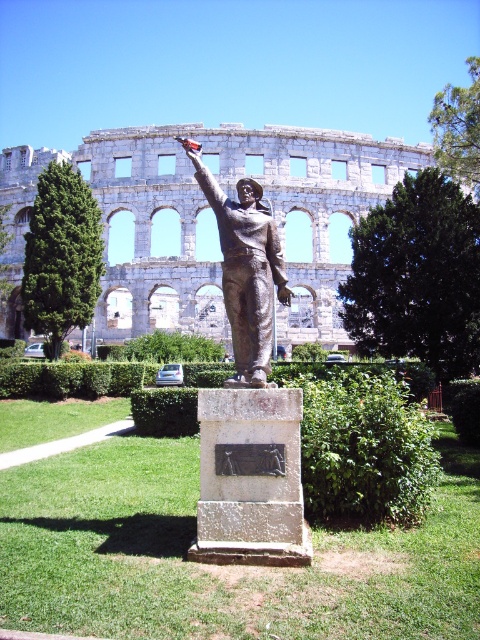
In the scene shown: You are a landscape architect designing a new garden layout. You need to place a large fountain between the gray stone amphitheater at upper center and the green leafy hedge at center. Which object should the fountain be closer to if it must be placed closer to the wider object?

The gray stone amphitheater at upper center is wider than the green leafy hedge at center. Therefore, the fountain should be placed closer to the gray stone amphitheater at upper center.

You are standing at the center of the grassy area and want to take a photo of the bronze statue at center. To ensure the statue is perfectly centered in your photo, where should you position yourself relative to the point marked at coordinates [245,269]?

To center the bronze statue at center in your photo, you should position yourself directly at the point marked at coordinates [245,269], as that is the location of the statue.

You are standing in front of the bronze statue and want to determine the relative positions of two points on the statue. The first point is at coordinates point (327,204) and the second is at point (242,248). Which point is closer to you?

Point (327,204) is further to the viewer than point (242,248), so point (242,248) is closer to you.